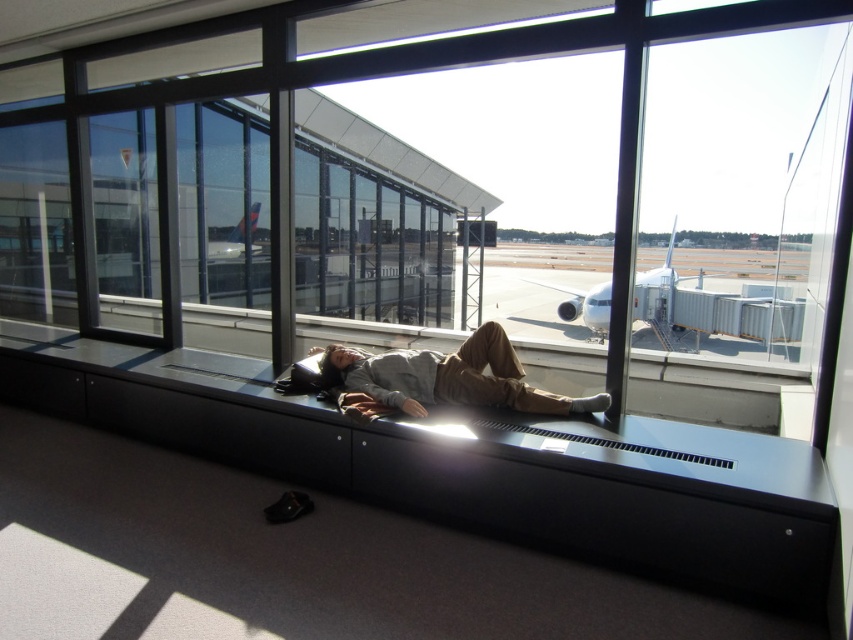
You are a passenger sitting at the airport terminal near the window. You notice two points marked in the scene. Which point, point (521, 376) or point (236, 232), is closer to your current position?

Point (521, 376) is closer to the camera than point (236, 232), so it is closer to your current position.

You are standing in the airport terminal and see the light brown cotton pants at center and the white glossy airplane at center through the window. Which object is nearer to you?

The light brown cotton pants at center is closer to the viewer than the white glossy airplane at center.